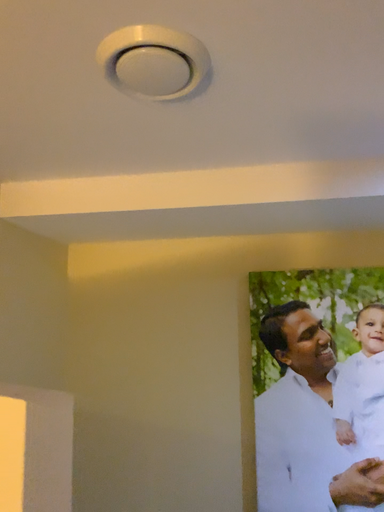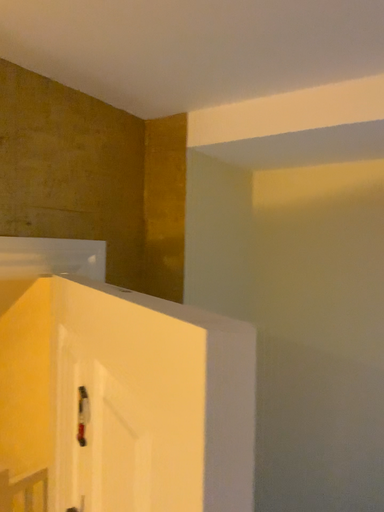
Question: How did the camera likely rotate when shooting the video?

Choices:
 (A) rotated downward
 (B) rotated upward

Answer: (A)